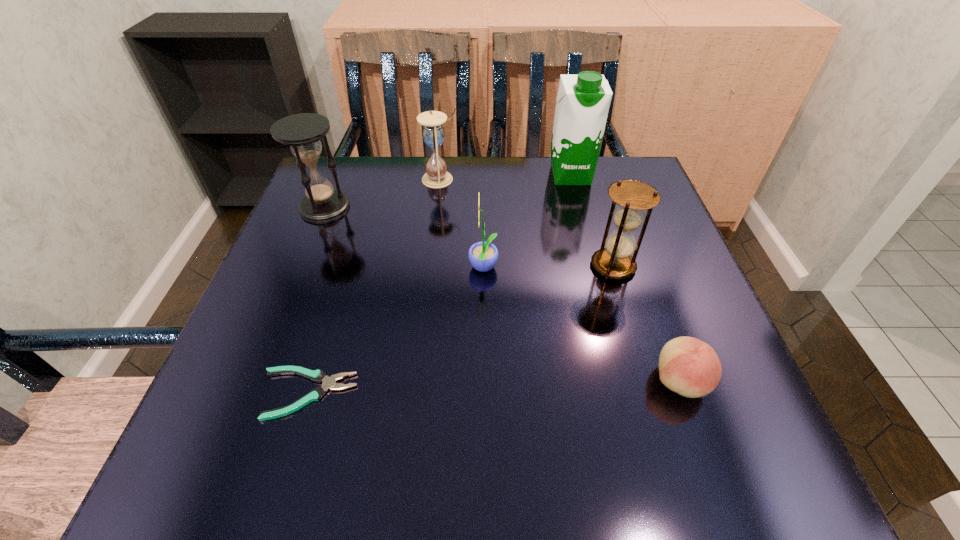
This screenshot has height=540, width=960. Identify the location of free spot located on the back of the leftmost hourglass. (344, 159).

This screenshot has height=540, width=960. Identify the location of blank area located on the back of the fifth object from right to left. (443, 158).

Identify the location of vacant position located 0.090m on the right of the rightmost hourglass. This screenshot has height=540, width=960. (682, 266).

Where is `vacant space located on the front-facing side of the fourth object from right to left`? The width and height of the screenshot is (960, 540). vacant space located on the front-facing side of the fourth object from right to left is located at coordinates (418, 269).

The image size is (960, 540). I want to click on vacant space positioned 0.340m on the front-facing side of the fourth object from right to left, so click(296, 269).

The width and height of the screenshot is (960, 540). I want to click on vacant point located on the front-facing side of the fourth object from right to left, so click(x=296, y=269).

This screenshot has width=960, height=540. In order to click on free region located on the left of the second shortest object in this screenshot , I will do `click(575, 381)`.

Find the location of a particular element. The image size is (960, 540). vacant area situated 0.150m on the right of the shortest object is located at coordinates (453, 394).

This screenshot has width=960, height=540. I want to click on soya milk present at the far edge, so click(x=582, y=104).

This screenshot has width=960, height=540. I want to click on object located in the near edge section of the desktop, so click(x=319, y=376).